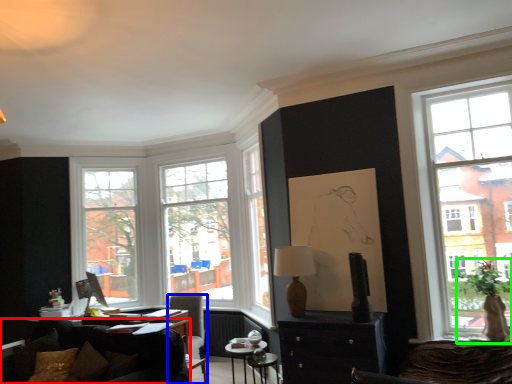
Question: Considering the real-world distances, which object is farthest from studio couch (highlighted by a red box)? chair (highlighted by a blue box) or houseplant (highlighted by a green box)?

Choices:
 (A) chair
 (B) houseplant

Answer: (B)